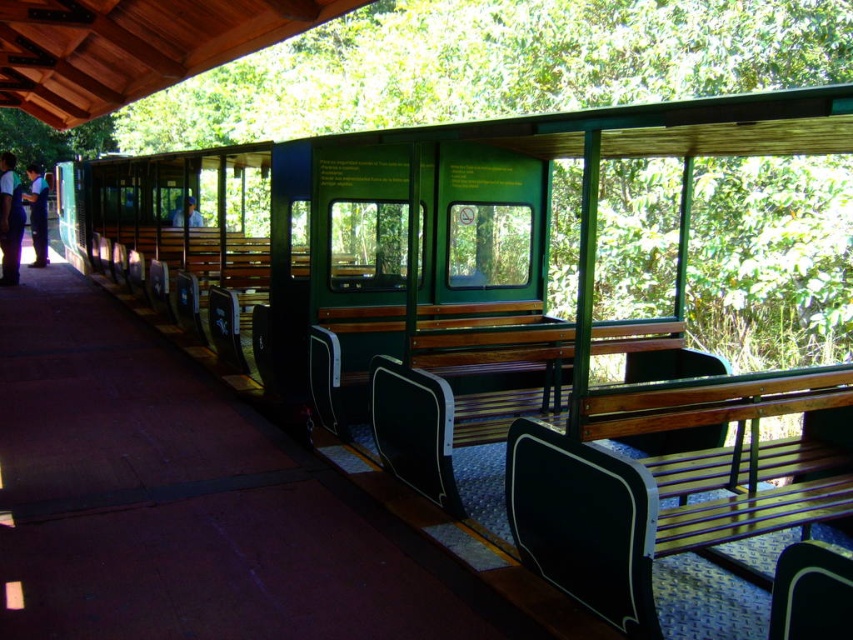
Who is positioned more to the right, green matte bench at center or black plastic chair at lower right?

black plastic chair at lower right

Who is lower down, green matte bench at center or black plastic chair at lower right?

black plastic chair at lower right is lower down.

Which is in front, point (213, 118) or point (816, 593)?

Point (816, 593)

Image resolution: width=853 pixels, height=640 pixels. I want to click on green matte bench at center, so click(x=496, y=65).

Is green matte bench at center wider than dark blue uniform at left?

Yes, green matte bench at center is wider than dark blue uniform at left.

Measure the distance between green matte bench at center and camera.

A distance of 25.01 feet exists between green matte bench at center and camera.

The image size is (853, 640). I want to click on green matte bench at center, so click(x=496, y=65).

Which is in front, point (834, 636) or point (36, 253)?

Point (834, 636) is in front.

Is point (775, 577) closer to viewer compared to point (45, 257)?

Yes, it is in front of point (45, 257).

Find the location of a particular element. This screenshot has height=640, width=853. black plastic chair at lower right is located at coordinates (811, 593).